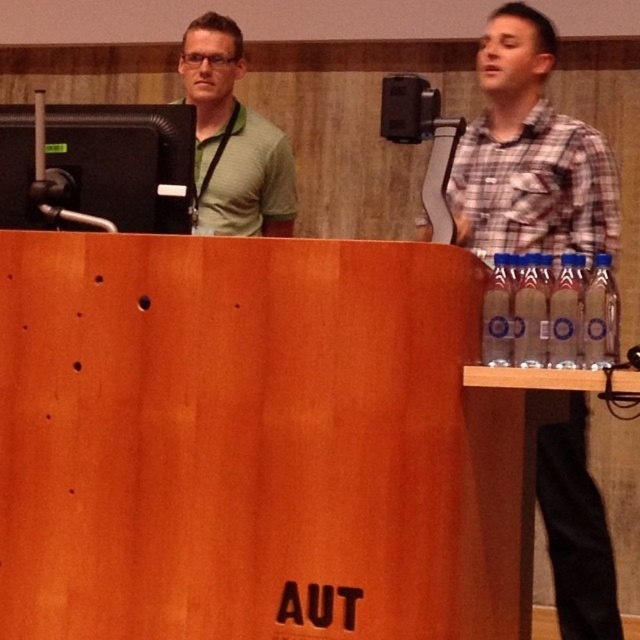
In the scene shown: You are an event organizer who needs to place a new decorative item on the podium. The podium has the clear plastic bottles at right and the metallic speaker at upper center. Where should you place the new item so it doesn not block the speaker or the bottles?

The new item should be placed below the metallic speaker at upper center and below the clear plastic bottles at right to avoid blocking them.

You are standing in front of the podium and want to place a small object on the closest point to you between the two points labeled point (516,60) and point (202,216). Which point should you choose?

Point (516,60) is closer to the viewer than point (202,216), so you should choose point (516,60).